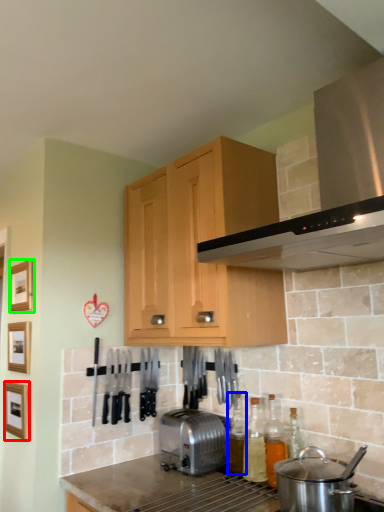
Question: Which object is the farthest from picture frame (highlighted by a red box)? Choose among these: bottle (highlighted by a blue box) or picture frame (highlighted by a green box).

Choices:
 (A) bottle
 (B) picture frame

Answer: (A)